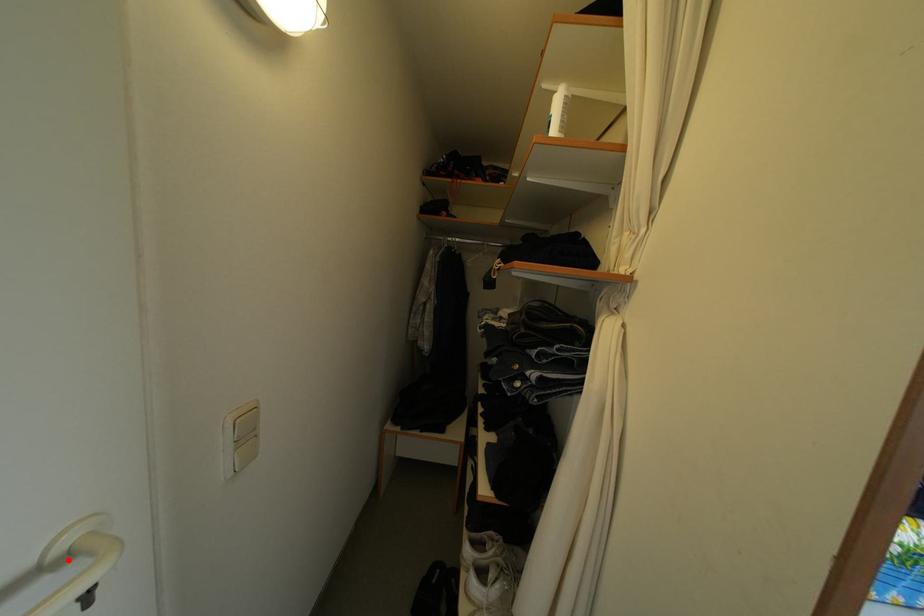
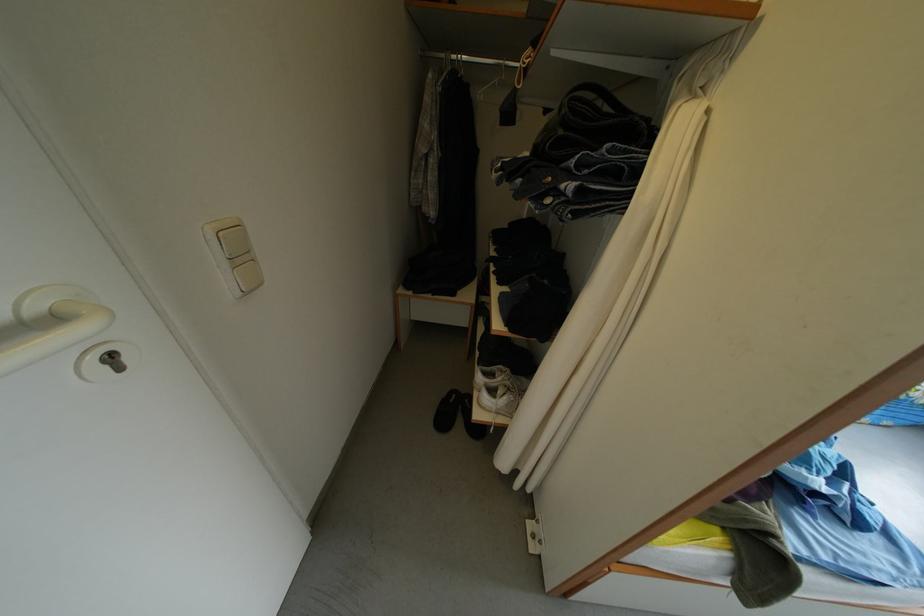
Locate, in the second image, the point that corresponds to the highlighted location in the first image.

(43, 317)